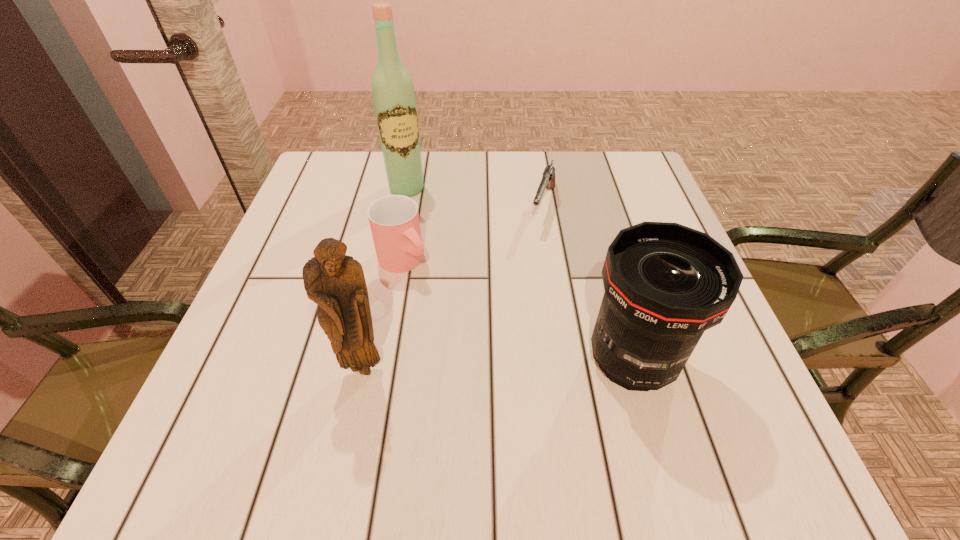
At what (x,y) coordinates should I click in order to perform the action: click on object that is at the right edge. Please return your answer as a coordinate pair (x, y). Looking at the image, I should click on (665, 284).

What are the coordinates of `object that is at the near right corner` in the screenshot? It's located at pyautogui.click(x=665, y=284).

At what (x,y) coordinates should I click in order to perform the action: click on vacant region at the far edge of the desktop. Please return your answer as a coordinate pair (x, y). Looking at the image, I should click on (568, 173).

Where is `vacant region at the near edge of the desktop`? Image resolution: width=960 pixels, height=540 pixels. vacant region at the near edge of the desktop is located at coordinates (455, 377).

I want to click on vacant region at the left edge of the desktop, so [x=310, y=245].

Locate an element on the screen. The image size is (960, 540). vacant space at the right edge of the desktop is located at coordinates (662, 215).

Locate an element on the screen. The height and width of the screenshot is (540, 960). vacant space at the far left corner is located at coordinates (363, 181).

You are a GUI agent. You are given a task and a screenshot of the screen. Output one action in this format:
    pyautogui.click(x=<x>, y=<y>)
    Task: Click on the vacant area at the near left corner of the desktop
    
    Given the screenshot: What is the action you would take?
    pyautogui.click(x=291, y=375)

You are a GUI agent. You are given a task and a screenshot of the screen. Output one action in this format:
    pyautogui.click(x=<x>, y=<y>)
    Task: Click on the blank space at the far right corner
    This screenshot has height=540, width=960.
    Given the screenshot: What is the action you would take?
    [x=584, y=153]

In order to click on free region at the near right corner in this screenshot , I will do `click(680, 390)`.